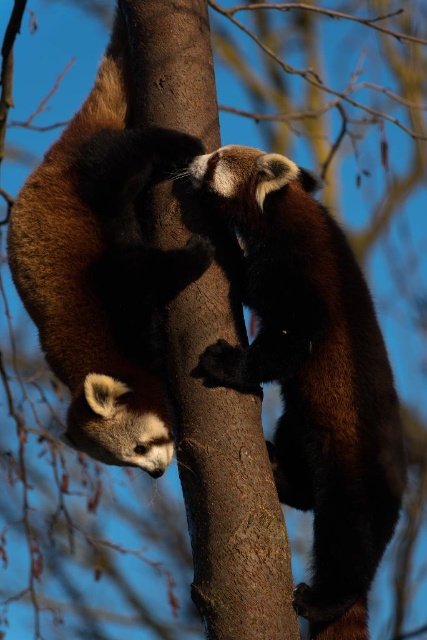
You are a wildlife photographer observing two brown furry pandas in a tree trunk. You need to capture a photo where the brown furry panda at center is visible above the brown furry panda at left. Is this possible given their current positions?

The brown furry panda at center is located below the brown furry panda at left, so it is not possible to capture a photo where the brown furry panda at center is visible above the brown furry panda at left in their current positions.

You are a wildlife photographer trying to capture a clear photo of both brown furry panda at center and brown furry panda at left. Based on their positions, which panda might be partially obscured in the photo?

The brown furry panda at left is behind the brown furry panda at center, so it might be partially obscured in the photo.